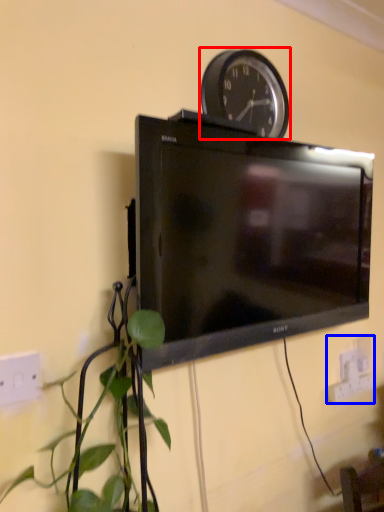
Question: Which point is further to the camera, wall clock (highlighted by a red box) or electric outlet (highlighted by a blue box)?

Choices:
 (A) wall clock
 (B) electric outlet

Answer: (B)